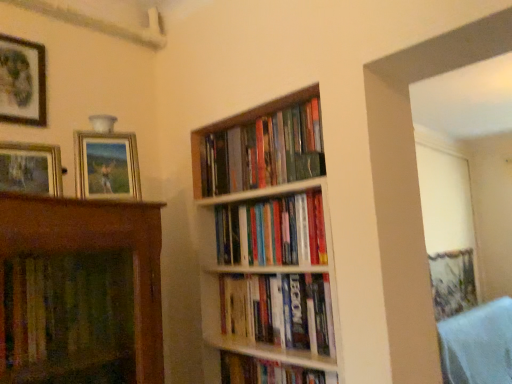
Question: Is hardcover books at center, arranged as the 1th book when viewed from the top, aimed at matte black picture frame at upper left, placed as the 3th picture frame when sorted from front to back?

Choices:
 (A) yes
 (B) no

Answer: (A)

Question: Is hardcover books at center, arranged as the 1th book when viewed from the top, located outside matte black picture frame at upper left, which is the 1th picture frame in left-to-right order?

Choices:
 (A) yes
 (B) no

Answer: (A)

Question: Does hardcover books at center, which appears as the 4th book when ordered from the bottom, lie behind matte black picture frame at upper left, which is the 3th picture frame from right to left?

Choices:
 (A) no
 (B) yes

Answer: (A)

Question: Can you confirm if hardcover books at center, which appears as the 4th book when ordered from the bottom, is shorter than matte black picture frame at upper left, placed as the 3th picture frame when sorted from front to back?

Choices:
 (A) yes
 (B) no

Answer: (A)

Question: From the image's perspective, is hardcover books at center, arranged as the 1th book when viewed from the top, under matte black picture frame at upper left, placed as the 3th picture frame when sorted from front to back?

Choices:
 (A) no
 (B) yes

Answer: (B)

Question: Is hardcover books at center, which is counted as the second book, starting from the top, taller or shorter than wooden bookshelf at center?

Choices:
 (A) short
 (B) tall

Answer: (A)

Question: Considering their positions, is hardcover books at center, which is counted as the second book, starting from the top, located in front of or behind wooden bookshelf at center?

Choices:
 (A) front
 (B) behind

Answer: (B)

Question: From a real-world perspective, is hardcover books at center, which is counted as the second book, starting from the top, physically located above or below wooden bookshelf at center?

Choices:
 (A) above
 (B) below

Answer: (A)

Question: In the image, is hardcover books at center, positioned as the third book in bottom-to-top order, on the left side or the right side of wooden bookshelf at center?

Choices:
 (A) right
 (B) left

Answer: (A)

Question: From the image's perspective, relative to hardcover books at center, positioned as the third book in bottom-to-top order, is matte wooden picture frame at left, positioned as the third picture frame in back-to-front order, above or below?

Choices:
 (A) above
 (B) below

Answer: (A)

Question: In terms of width, does matte wooden picture frame at left, positioned as the third picture frame in back-to-front order, look wider or thinner when compared to hardcover books at center, positioned as the third book in bottom-to-top order?

Choices:
 (A) wide
 (B) thin

Answer: (B)

Question: Considering the positions of point (59, 172) and point (236, 226), is point (59, 172) closer or farther from the camera than point (236, 226)?

Choices:
 (A) farther
 (B) closer

Answer: (B)

Question: Considering the positions of matte wooden picture frame at left, the 2th picture frame when ordered from right to left, and hardcover books at center, which is counted as the second book, starting from the top, in the image, is matte wooden picture frame at left, the 2th picture frame when ordered from right to left, bigger or smaller than hardcover books at center, which is counted as the second book, starting from the top,?

Choices:
 (A) big
 (B) small

Answer: (B)

Question: Which is correct: hardcover books at center, positioned as the third book in bottom-to-top order, is inside hardcover books at center, the 3th book from the top, or outside of it?

Choices:
 (A) outside
 (B) inside

Answer: (A)

Question: Considering the relative positions of hardcover books at center, positioned as the third book in bottom-to-top order, and hardcover books at center, the second book positioned from the bottom, in the image provided, is hardcover books at center, positioned as the third book in bottom-to-top order, to the left or to the right of hardcover books at center, the second book positioned from the bottom,?

Choices:
 (A) right
 (B) left

Answer: (B)